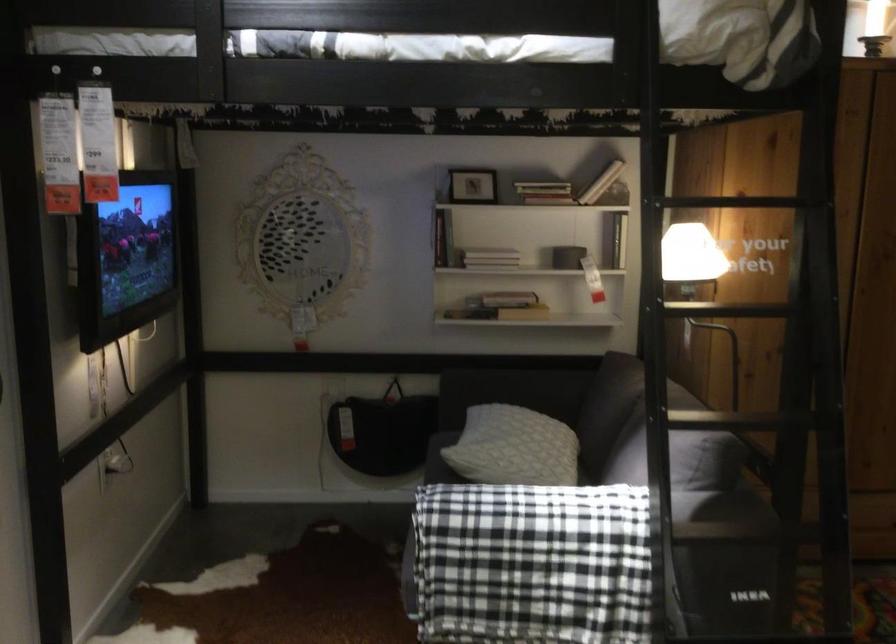
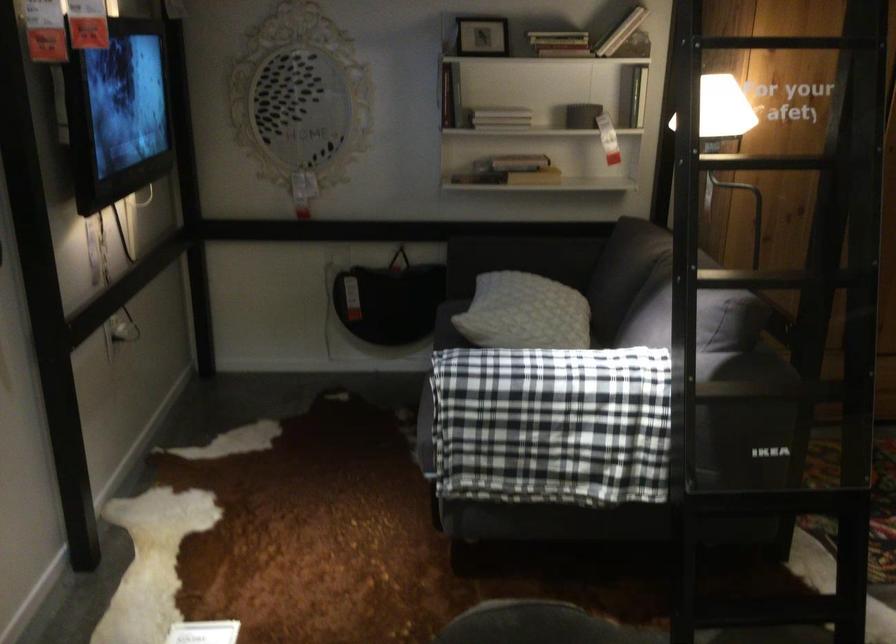
In the second image, find the point that corresponds to the point at 530,570 in the first image.

(552, 424)